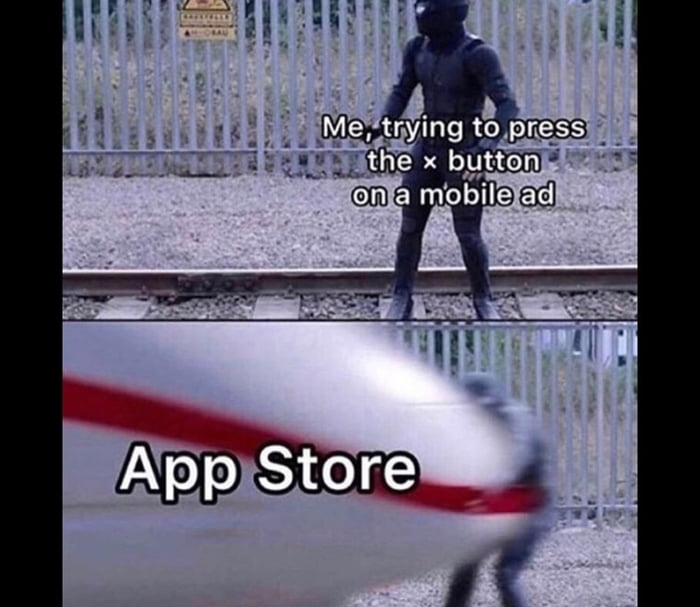
Where is `black line between frames`? Image resolution: width=700 pixels, height=607 pixels. black line between frames is located at coordinates (374, 319).